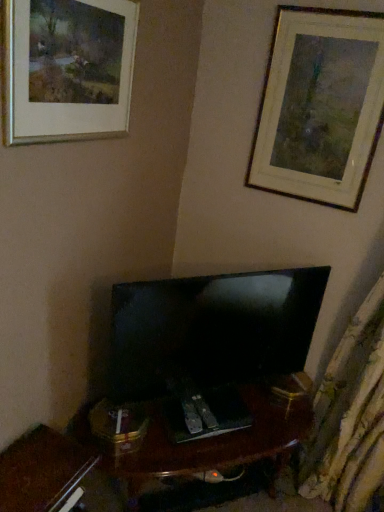
Question: From the image's perspective, is silver metallic picture frame at upper left, marked as the first picture frame in a left-to-right arrangement, above or below wooden picture frame at upper right, which ranks as the first picture frame in right-to-left order?

Choices:
 (A) above
 (B) below

Answer: (B)

Question: Is silver metallic picture frame at upper left, marked as the first picture frame in a left-to-right arrangement, in front of or behind wooden picture frame at upper right, positioned as the 2th picture frame in left-to-right order, in the image?

Choices:
 (A) front
 (B) behind

Answer: (A)

Question: Estimate the real-world distances between objects in this image. Which object is closer to the silver metallic picture frame at upper left, which appears as the 1th picture frame when viewed from the front?

Choices:
 (A) wooden picture frame at upper right, positioned as the 1th picture frame in back-to-front order
 (B) matte black tv at center

Answer: (B)

Question: Estimate the real-world distances between objects in this image. Which object is closer to the wooden picture frame at upper right, which ranks as the first picture frame in right-to-left order?

Choices:
 (A) silver metallic picture frame at upper left, which appears as the 1th picture frame when viewed from the front
 (B) matte black tv at center

Answer: (B)